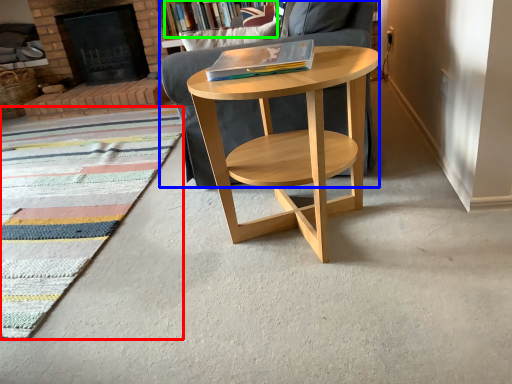
Question: Estimate the real-world distances between objects in this image. Which object is farther from mat (highlighted by a red box), chair (highlighted by a blue box) or bookcase (highlighted by a green box)?

Choices:
 (A) chair
 (B) bookcase

Answer: (B)